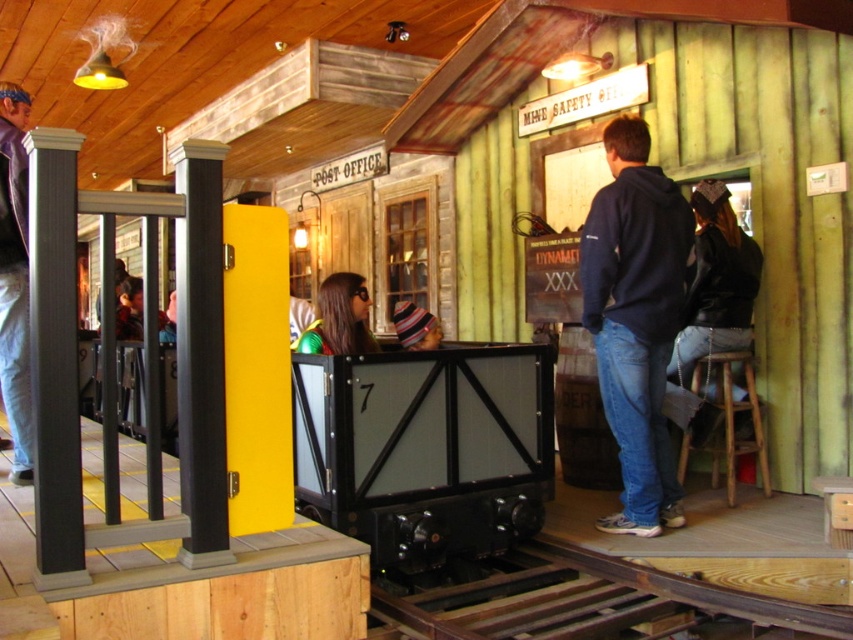
Who is shorter, wooden stool at lower right or shiny green jacket at center?

shiny green jacket at center is shorter.

Is the position of wooden stool at lower right more distant than that of shiny green jacket at center?

Yes, it is.

Describe the element at coordinates (730, 417) in the screenshot. I see `wooden stool at lower right` at that location.

The image size is (853, 640). In order to click on wooden stool at lower right in this screenshot , I will do `click(730, 417)`.

Is purple leather jacket at left behind shiny green jacket at center?

No, purple leather jacket at left is closer to the viewer.

This screenshot has height=640, width=853. In order to click on purple leather jacket at left in this screenshot , I will do `click(15, 276)`.

Based on the photo, can you confirm if navy blue hoodie at center is shorter than striped knit cap at center?

No.

In order to click on navy blue hoodie at center in this screenshot , I will do (x=636, y=317).

Locate an element on the screen. navy blue hoodie at center is located at coordinates pos(636,317).